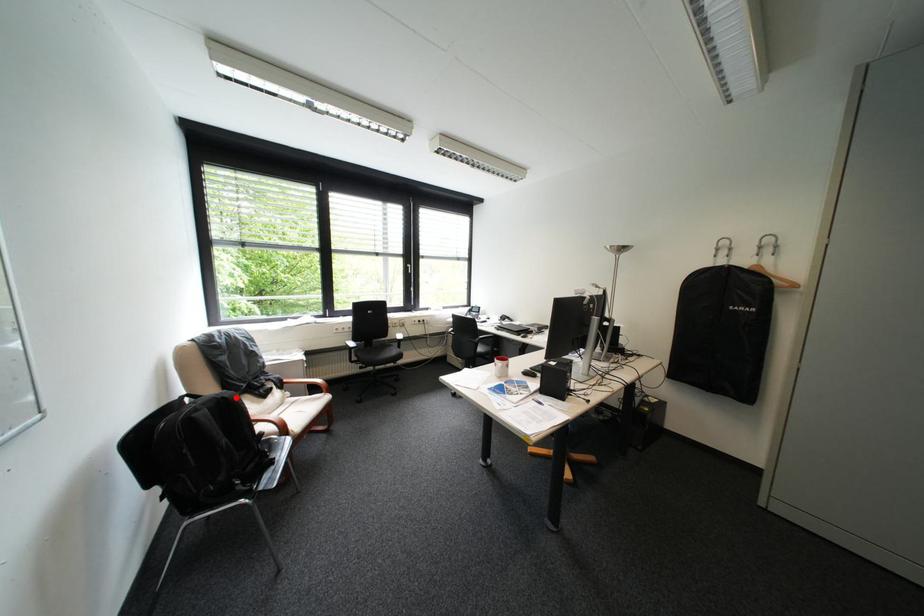
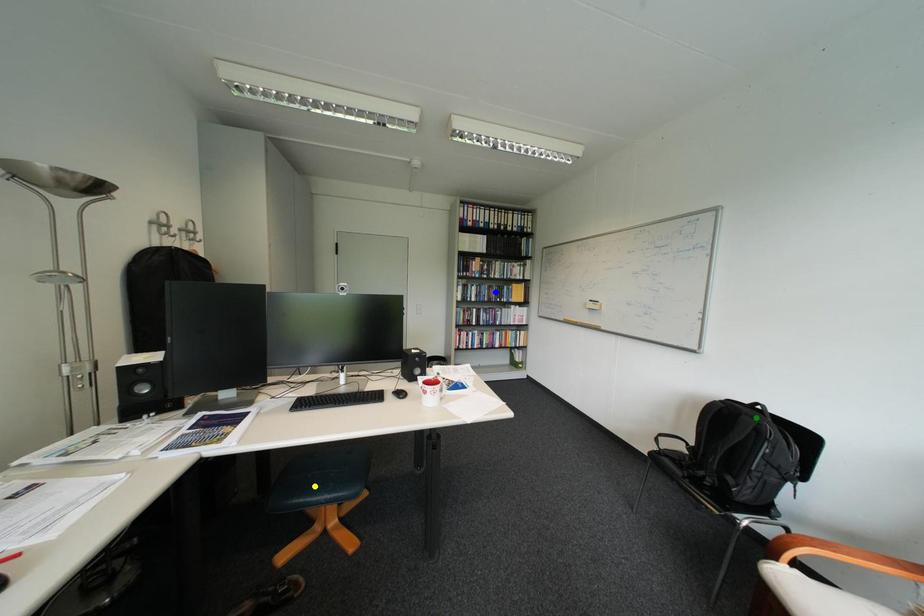
Question: I am providing you with two images of the same scene from different viewpoints. A red point is marked on the first image. You are given multiple points on the second image. Which point in image 2 is actually the same real-world point as the red point in image 1?

Choices:
 (A) green point
 (B) yellow point
 (C) blue point

Answer: (A)